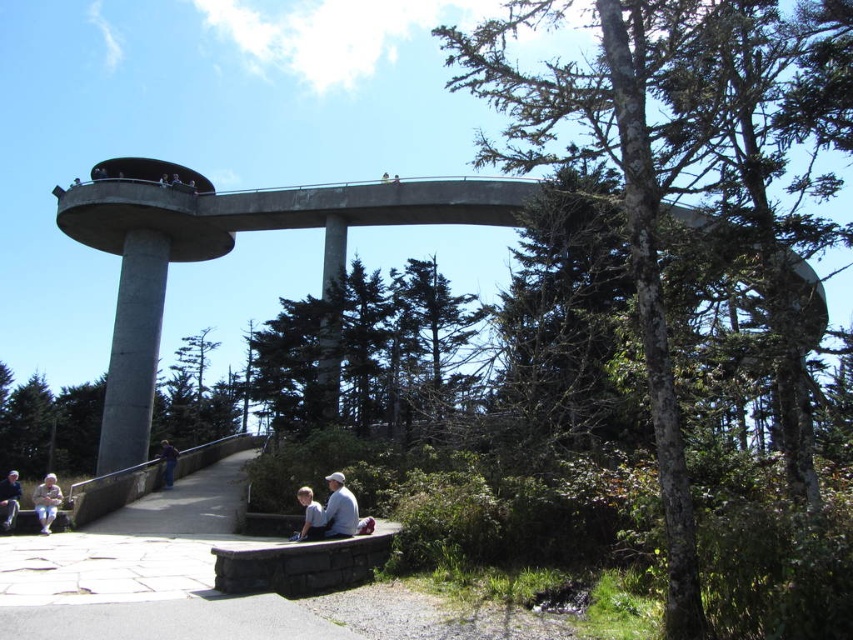
Question: Among these objects, which one is farthest from the camera?

Choices:
 (A) light gray concrete bench at lower center
 (B) light blue denim jacket at lower center
 (C) light blue shirt at lower center
 (D) light beige fabric jacket at lower left

Answer: (A)

Question: Which point is closer to the camera?

Choices:
 (A) light gray concrete bench at lower center
 (B) light blue denim jacket at lower center

Answer: (B)

Question: Does light blue denim jacket at lower center appear on the left side of gray fabric shirt at lower center?

Choices:
 (A) yes
 (B) no

Answer: (A)

Question: Based on their relative distances, which object is nearer to the light blue denim jacket at lower center?

Choices:
 (A) light blue shirt at lower center
 (B) light beige fabric jacket at lower left
 (C) light gray concrete bench at lower center

Answer: (A)

Question: Is the position of light blue denim jacket at lower center less distant than that of light brown leather jacket at lower left?

Choices:
 (A) yes
 (B) no

Answer: (A)

Question: Where is green leafy tree at upper center located in relation to light blue denim jacket at lower center in the image?

Choices:
 (A) below
 (B) above

Answer: (B)